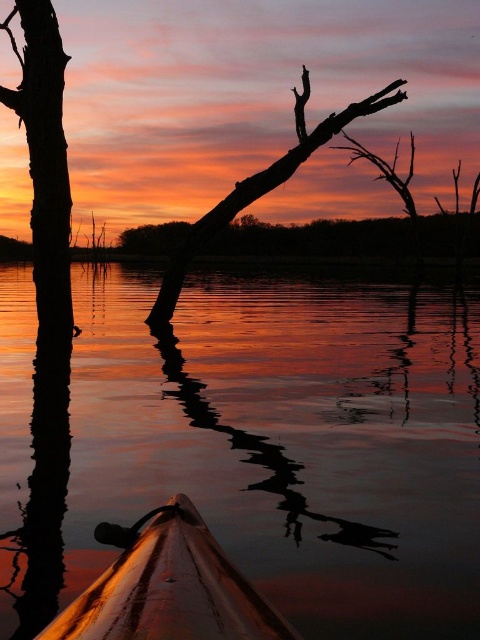
What do you see at coordinates (170, 589) in the screenshot? I see `wooden kayak at center` at bounding box center [170, 589].

Which of these two, wooden kayak at center or silhouette wood at left, stands shorter?

With less height is wooden kayak at center.

This screenshot has height=640, width=480. What do you see at coordinates (170, 589) in the screenshot?
I see `wooden kayak at center` at bounding box center [170, 589].

This screenshot has width=480, height=640. I want to click on wooden kayak at center, so click(x=170, y=589).

Between glossy water at center and silhouette wood at center, which one is positioned lower?

glossy water at center is below.

Can you confirm if glossy water at center is wider than silhouette wood at center?

Yes.

Which is behind, point (1, 556) or point (253, 200)?

The point (253, 200) is more distant.

You are a GUI agent. You are given a task and a screenshot of the screen. Output one action in this format:
    pyautogui.click(x=<x>, y=<y>)
    Task: Click on the glossy water at center
    
    Given the screenshot: What is the action you would take?
    pyautogui.click(x=289, y=440)

Is wooden kayak at center bigger than silhouette wood at center?

Yes, wooden kayak at center is bigger than silhouette wood at center.

Who is positioned more to the right, wooden kayak at center or silhouette wood at center?

From the viewer's perspective, wooden kayak at center appears more on the right side.

Which is behind, point (152, 593) or point (240, 209)?

The point (240, 209) is behind.

The image size is (480, 640). I want to click on wooden kayak at center, so click(170, 589).